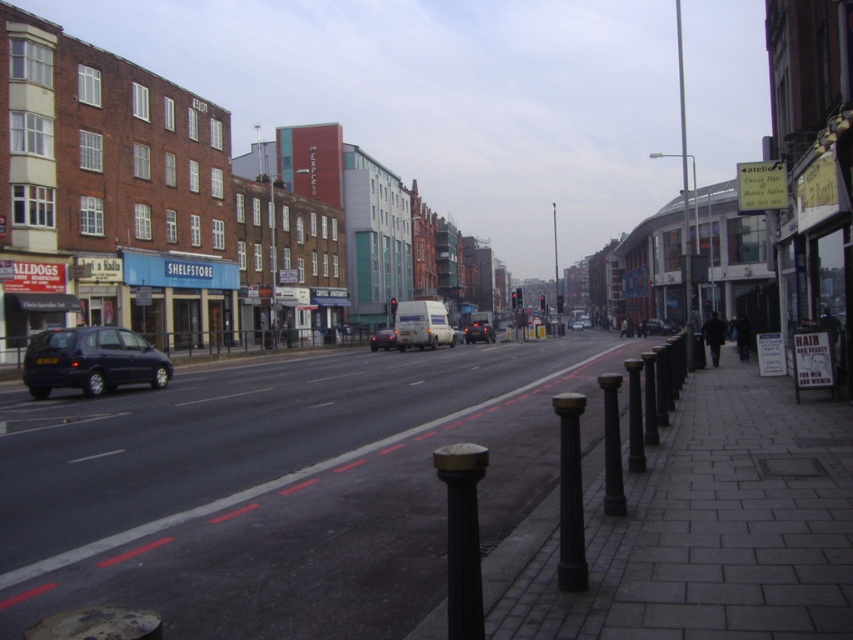
Between black concrete pavement at lower right and matte black car at center, which one has more height?

matte black car at center

Does point (564, 390) come behind point (570, 320)?

No, (564, 390) is in front of (570, 320).

Identify the location of black concrete pavement at lower right. (279, 486).

Who is higher up, metallic pole at right or black metal pole at lower right?

metallic pole at right is higher up.

Does metallic pole at right have a lesser width compared to black metal pole at lower right?

No.

The image size is (853, 640). What are the coordinates of `metallic pole at right` in the screenshot? It's located at (683, 198).

Is white matte van at center smaller than matte black van at center?

No, white matte van at center is not smaller than matte black van at center.

Is point (392, 333) behind point (660, 324)?

No.

Image resolution: width=853 pixels, height=640 pixels. Identify the location of white matte van at center. (381, 339).

Where is `white matte van at center`? white matte van at center is located at coordinates (381, 339).